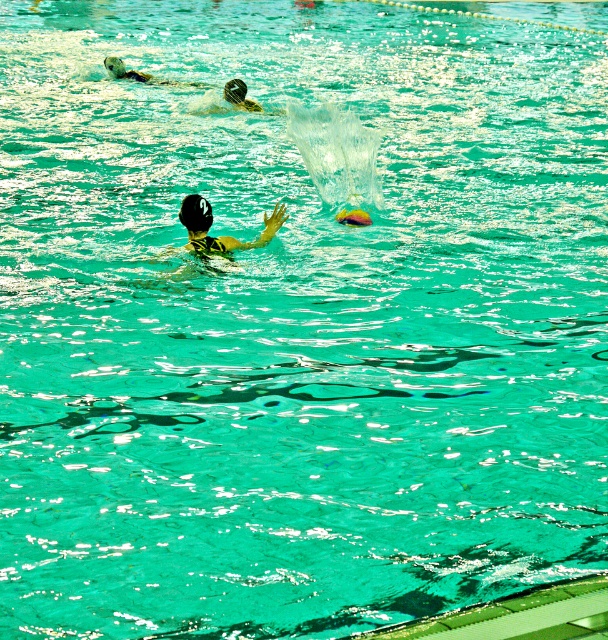
Does yellow-green swim cap at center appear over black matte swim cap at upper center?

Actually, yellow-green swim cap at center is below black matte swim cap at upper center.

Can you confirm if yellow-green swim cap at center is shorter than black matte swim cap at upper center?

No, yellow-green swim cap at center is not shorter than black matte swim cap at upper center.

This screenshot has width=608, height=640. In order to click on yellow-green swim cap at center in this screenshot , I will do `click(219, 236)`.

Between black matte swim cap at center and black matte swim cap at upper center, which one is positioned higher?

Positioned higher is black matte swim cap at upper center.

From the picture: Is black matte swim cap at center below black matte swim cap at upper center?

Indeed, black matte swim cap at center is positioned under black matte swim cap at upper center.

Describe the element at coordinates (195, 212) in the screenshot. The width and height of the screenshot is (608, 640). I see `black matte swim cap at center` at that location.

Where is `black matte swim cap at center`? The image size is (608, 640). black matte swim cap at center is located at coordinates (195, 212).

Between yellow-green swim cap at center and black matte swim cap at center, which one has more height?

With more height is yellow-green swim cap at center.

Does yellow-green swim cap at center appear under black matte swim cap at center?

Indeed, yellow-green swim cap at center is positioned under black matte swim cap at center.

Is point (212, 252) positioned before point (206, 225)?

That is False.

At what (x,y) coordinates should I click in order to perform the action: click on yellow-green swim cap at center. Please return your answer as a coordinate pair (x, y). Looking at the image, I should click on point(219,236).